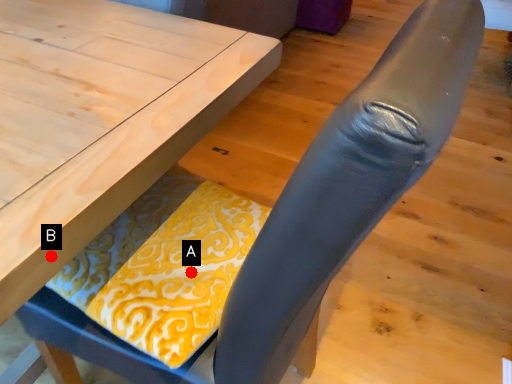
Question: Two points are circled on the image, labeled by A and B beside each circle. Which point is closer to the camera?

Choices:
 (A) A is closer
 (B) B is closer

Answer: (B)